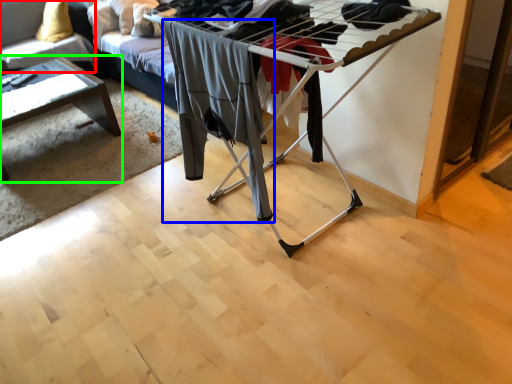
Question: Which is nearer to the couch (highlighted by a red box)? clothing (highlighted by a blue box) or table (highlighted by a green box).

Choices:
 (A) clothing
 (B) table

Answer: (B)